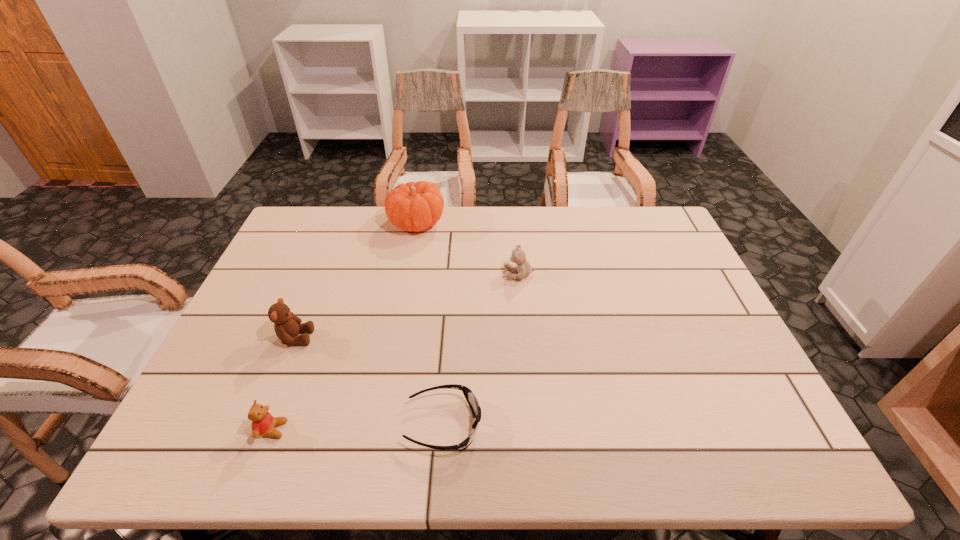
Where is `empty space between the tallest teddy bear and the farthest teddy bear`? This screenshot has height=540, width=960. empty space between the tallest teddy bear and the farthest teddy bear is located at coordinates (407, 306).

The image size is (960, 540). I want to click on empty space between the farthest teddy bear and the nearest teddy bear, so click(x=396, y=352).

At what (x,y) coordinates should I click in order to perform the action: click on blank region between the fourth nearest object and the third nearest object. Please return your answer as a coordinate pair (x, y). This screenshot has width=960, height=540. Looking at the image, I should click on (407, 306).

What are the coordinates of `blank region between the rightmost object and the fourth shortest object` in the screenshot? It's located at (407, 306).

Select which object appears as the third closest to the fourth nearest object. Please provide its 2D coordinates. Your answer should be formatted as a tuple, i.e. [(x, y)], where the tuple contains the x and y coordinates of a point satisfying the conditions above.

[(287, 326)]

This screenshot has height=540, width=960. In order to click on object that stands as the third closest to the shortest object in this screenshot , I will do `click(518, 256)`.

Find the location of a particular element. This screenshot has height=540, width=960. teddy bear that is the closest to the farthest object is located at coordinates (518, 256).

At what (x,y) coordinates should I click in order to perform the action: click on the second closest teddy bear to the tallest teddy bear. Please return your answer as a coordinate pair (x, y). The height and width of the screenshot is (540, 960). Looking at the image, I should click on (518, 256).

Image resolution: width=960 pixels, height=540 pixels. I want to click on free point that satisfies the following two spatial constraints: 1. on the front side of the farthest object; 2. on the front-facing side of the nearest teddy bear, so click(x=378, y=429).